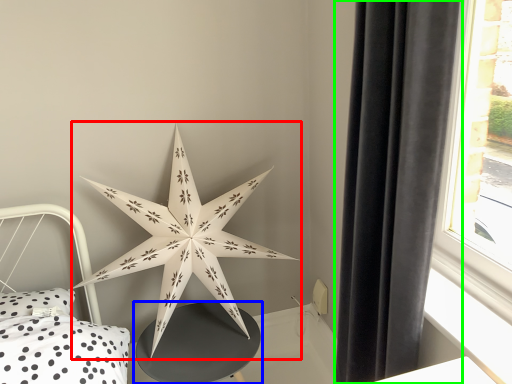
Question: Which object is positioned farthest from star (highlighted by a red box)? Select from table (highlighted by a blue box) and curtain (highlighted by a green box).

Choices:
 (A) table
 (B) curtain

Answer: (B)